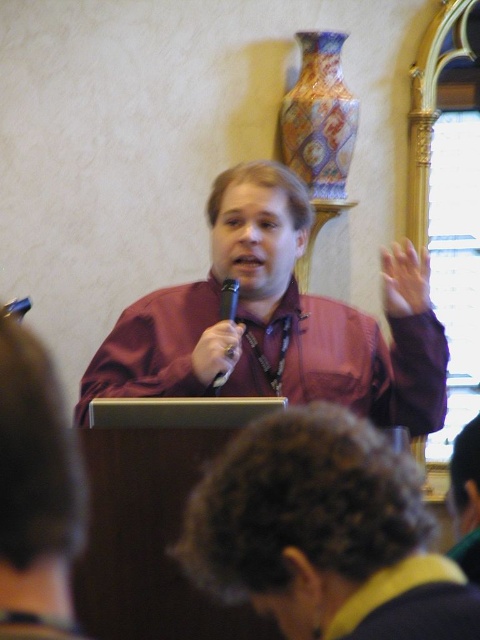
Question: Which of the following is the closest to the observer?

Choices:
 (A) black metallic microphone at center
 (B) satin burgundy shirt at center
 (C) multicolored ceramic vase at upper right

Answer: (A)

Question: Which is farther from the matte maroon shirt at center?

Choices:
 (A) satin burgundy shirt at center
 (B) black metallic microphone at center
 (C) matte skin hand at upper right

Answer: (C)

Question: Does matte maroon shirt at center lie behind matte skin hand at upper right?

Choices:
 (A) yes
 (B) no

Answer: (B)

Question: Is matte maroon shirt at center wider than matte black microphone at center?

Choices:
 (A) no
 (B) yes

Answer: (A)

Question: Is multicolored ceramic vase at upper right positioned at the back of matte black microphone at center?

Choices:
 (A) no
 (B) yes

Answer: (B)

Question: Which object is positioned farthest from the matte maroon shirt at center?

Choices:
 (A) matte skin hand at upper right
 (B) multicolored ceramic vase at upper right
 (C) black metallic microphone at center

Answer: (B)